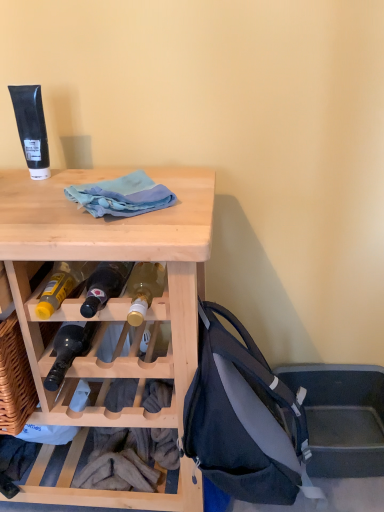
This screenshot has height=512, width=384. In order to click on empty space that is ontop of natural wood desk at upper left in this screenshot , I will do `click(79, 207)`.